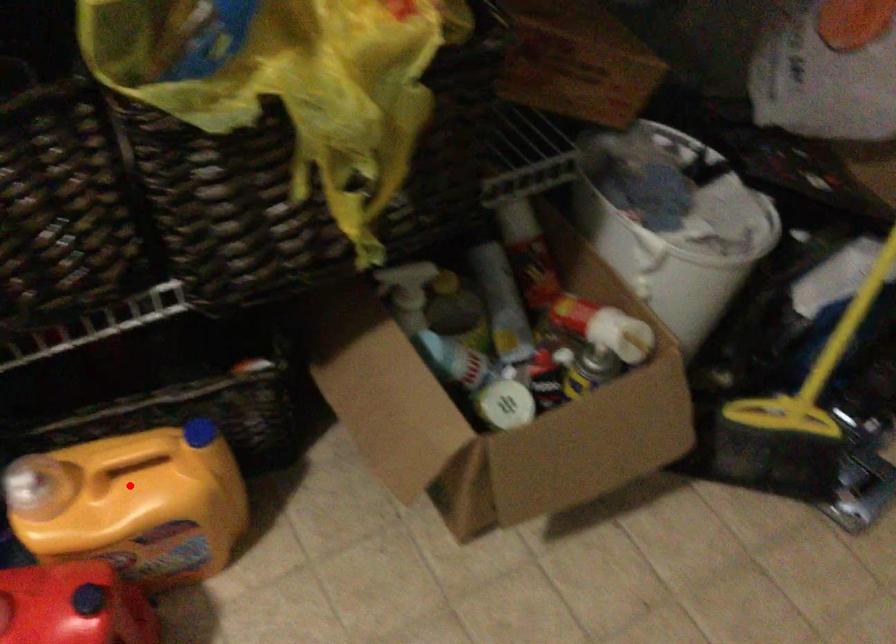
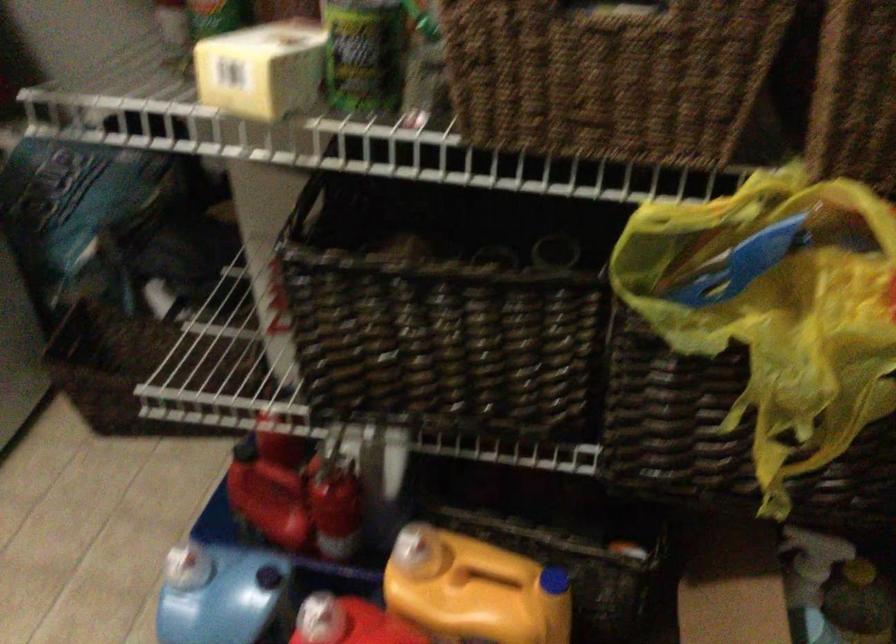
Question: I am providing you with two images of the same scene from different viewpoints. In image1, a red point is highlighted. Considering the same 3D point in image2, which of the following is correct?

Choices:
 (A) It is closer
 (B) It is farther

Answer: (B)